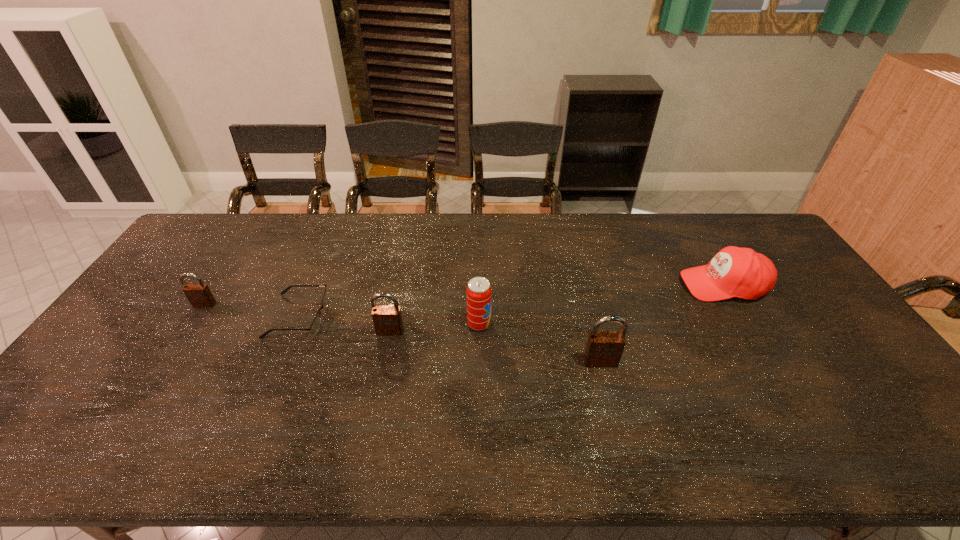
Where is `the farthest padlock`? The height and width of the screenshot is (540, 960). the farthest padlock is located at coordinates (199, 295).

Identify the location of the leftmost padlock. (199, 295).

You are a GUI agent. You are given a task and a screenshot of the screen. Output one action in this format:
    pyautogui.click(x=<x>, y=<y>)
    Task: Click on the second farthest padlock
    
    Given the screenshot: What is the action you would take?
    pyautogui.click(x=387, y=320)

Where is `the fourth object from right to left`? This screenshot has height=540, width=960. the fourth object from right to left is located at coordinates (387, 320).

Image resolution: width=960 pixels, height=540 pixels. Identify the location of the rightmost padlock. (604, 348).

Find the location of `the nearest padlock`. the nearest padlock is located at coordinates (604, 348).

Identify the location of the rightmost object. The width and height of the screenshot is (960, 540). (738, 272).

Where is `soda can`? soda can is located at coordinates (479, 293).

The height and width of the screenshot is (540, 960). What are the coordinates of `the second object from left to right` in the screenshot? It's located at (314, 327).

Locate an element on the screen. The image size is (960, 540). spectacles is located at coordinates (314, 327).